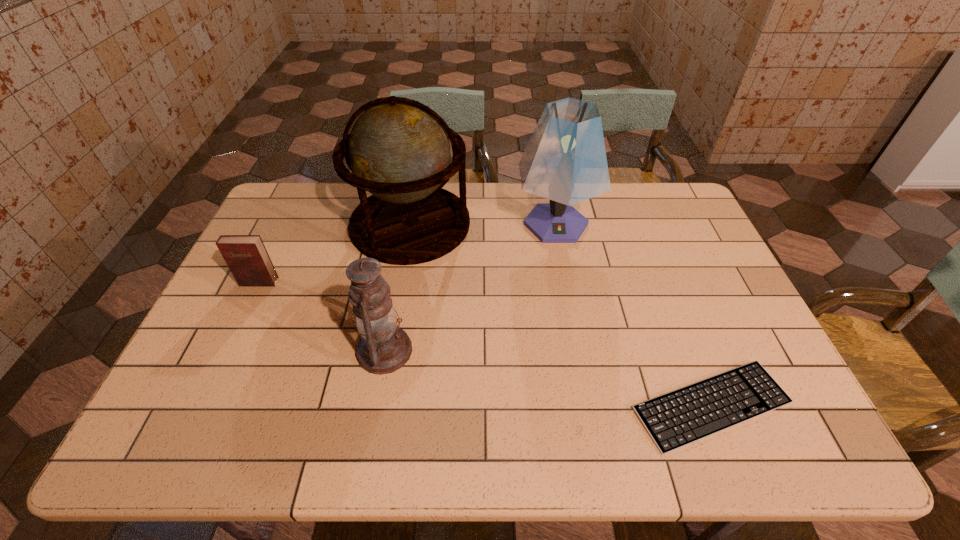
Identify the location of free area in between the oil lamp and the second shortest object. Image resolution: width=960 pixels, height=540 pixels. (322, 316).

Choose which object is the nearest neighbor to the oil lamp. Please provide its 2D coordinates. Your answer should be formatted as a tuple, i.e. [(x, y)], where the tuple contains the x and y coordinates of a point satisfying the conditions above.

[(398, 150)]

Where is `object that stands as the fourth closest to the diary`? object that stands as the fourth closest to the diary is located at coordinates (681, 417).

Find the location of a particular element. This screenshot has height=540, width=960. vacant space that satisfies the following two spatial constraints: 1. on the base of the shortest object; 2. on the left side of the lampshade is located at coordinates (589, 406).

Locate an element on the screen. The width and height of the screenshot is (960, 540). free point that satisfies the following two spatial constraints: 1. on the front-facing side of the globe; 2. on the left side of the shortest object is located at coordinates (379, 406).

The image size is (960, 540). Find the location of `free point that satisfies the following two spatial constraints: 1. on the front cover of the shortest object; 2. on the left side of the diary`. free point that satisfies the following two spatial constraints: 1. on the front cover of the shortest object; 2. on the left side of the diary is located at coordinates (200, 406).

At what (x,y) coordinates should I click in order to perform the action: click on vacant region that satisfies the following two spatial constraints: 1. on the front cover of the second shortest object; 2. on the right side of the computer keyboard. Please return your answer as a coordinate pair (x, y). Looking at the image, I should click on (200, 406).

Where is `free location that satisfies the following two spatial constraints: 1. on the front-facing side of the globe; 2. on the front cover of the third nearest object`? free location that satisfies the following two spatial constraints: 1. on the front-facing side of the globe; 2. on the front cover of the third nearest object is located at coordinates (400, 282).

At what (x,y) coordinates should I click in order to perform the action: click on vacant region that satisfies the following two spatial constraints: 1. on the back side of the shortest object; 2. on the front-facing side of the globe. Please return your answer as a coordinate pair (x, y). The image size is (960, 540). Looking at the image, I should click on (640, 224).

The image size is (960, 540). In order to click on free location that satisfies the following two spatial constraints: 1. on the front-facing side of the globe; 2. on the front cover of the leftmost object in this screenshot , I will do `click(400, 282)`.